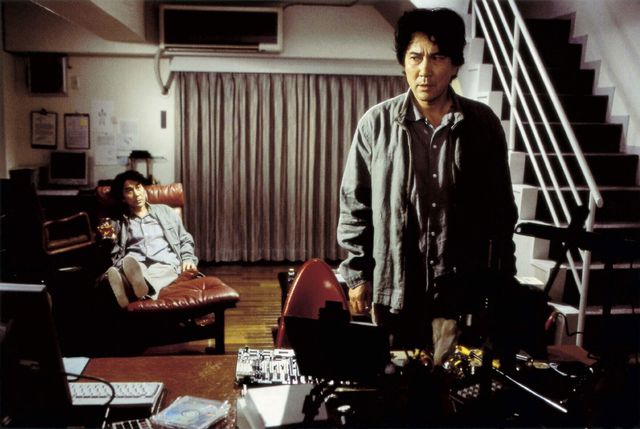
In order to click on footrest in this screenshot , I will do pyautogui.click(x=196, y=301).